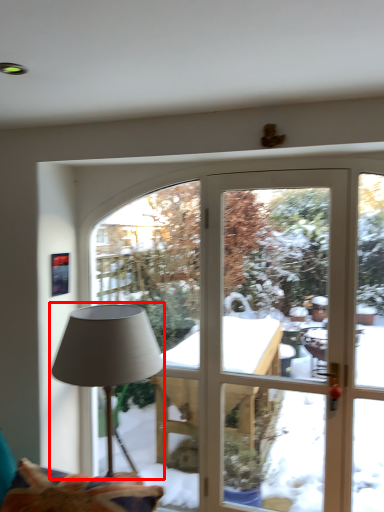
Question: From the image's perspective, where is lamp (annotated by the red box) located in relation to swivel chair in the image?

Choices:
 (A) above
 (B) below

Answer: (A)